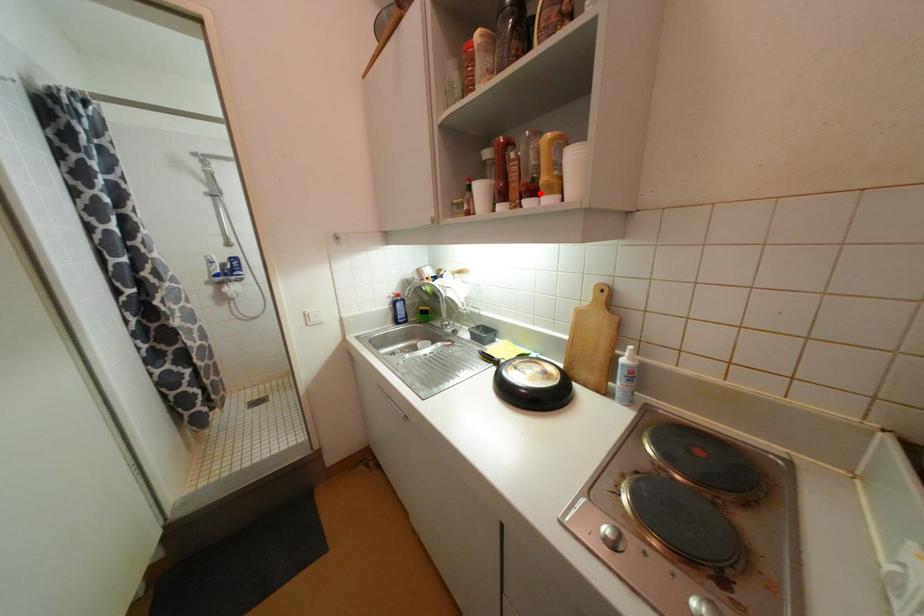
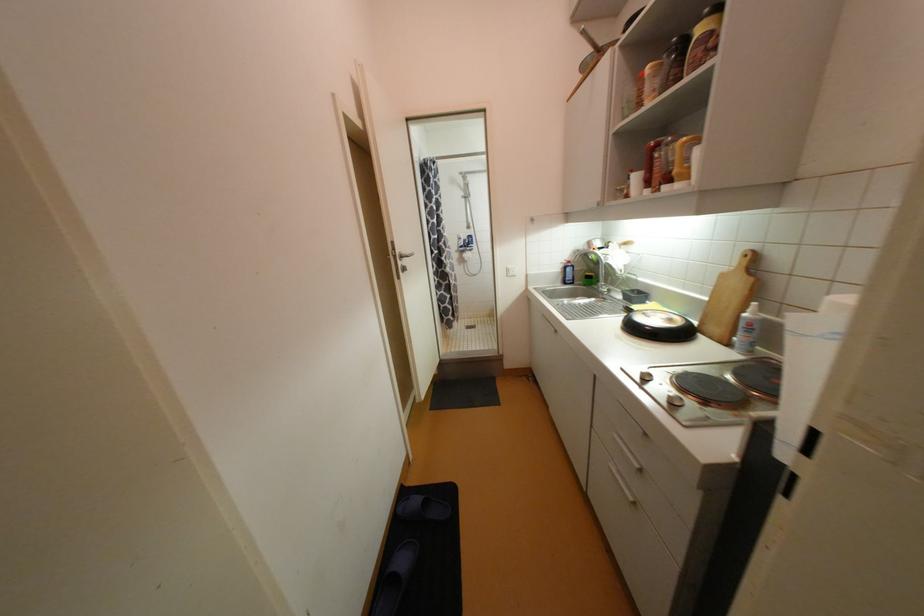
Where in the second image is the point corresponding to the highlighted location from the first image?

(675, 180)